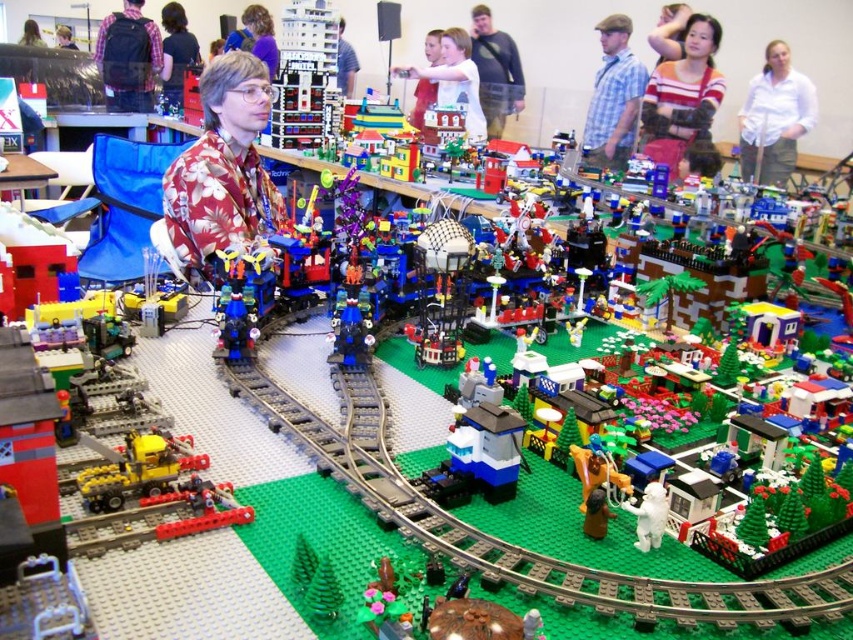
Question: Which of the following is the farthest from the observer?

Choices:
 (A) (630, 61)
 (B) (135, 467)
 (C) (260, 118)
 (D) (160, 65)

Answer: (D)

Question: Is yellow matte truck at lower left closer to camera compared to matte black backpack at upper left?

Choices:
 (A) yes
 (B) no

Answer: (A)

Question: Where is floral shirt at center located in relation to matte black hair at upper left in the image?

Choices:
 (A) right
 (B) left

Answer: (A)

Question: Among these objects, which one is farthest from the camera?

Choices:
 (A) yellow matte truck at lower left
 (B) matte black backpack at upper left

Answer: (B)

Question: Does light brown hair at upper center appear over smooth white shirt at center?

Choices:
 (A) yes
 (B) no

Answer: (B)

Question: Which point is farther from the camera taking this photo?

Choices:
 (A) (39, 35)
 (B) (467, 35)
 (C) (62, 45)

Answer: (C)